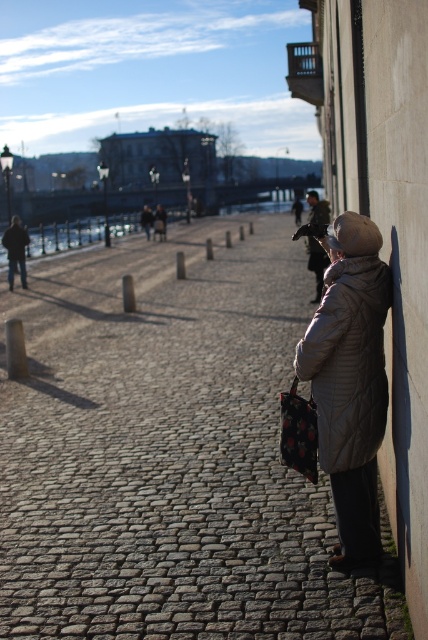
Between point (142, 362) and point (305, 349), which one is positioned behind?

The point (142, 362) is behind.

Is point (9, 493) closer to viewer compared to point (320, 452)?

No.

Find the location of a particular element. cobblestone pavement at right is located at coordinates (169, 452).